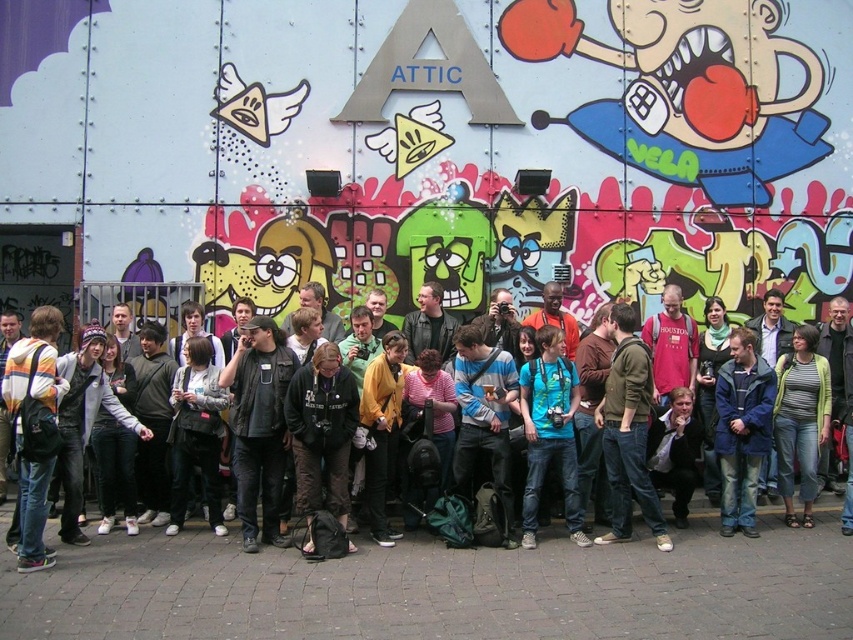
Question: Does blue fabric jacket at center have a larger size compared to dark gray jacket at center?

Choices:
 (A) no
 (B) yes

Answer: (A)

Question: Which object is farther from the camera taking this photo?

Choices:
 (A) blue fabric jacket at center
 (B) dark gray jacket at center

Answer: (A)

Question: Observing the image, what is the correct spatial positioning of blue fabric jacket at center in reference to dark gray jacket at center?

Choices:
 (A) left
 (B) right

Answer: (B)

Question: Can you confirm if blue fabric jacket at center is wider than dark gray jacket at center?

Choices:
 (A) yes
 (B) no

Answer: (B)

Question: Which point is farther to the camera?

Choices:
 (A) dark gray jacket at center
 (B) blue fabric jacket at center

Answer: (B)